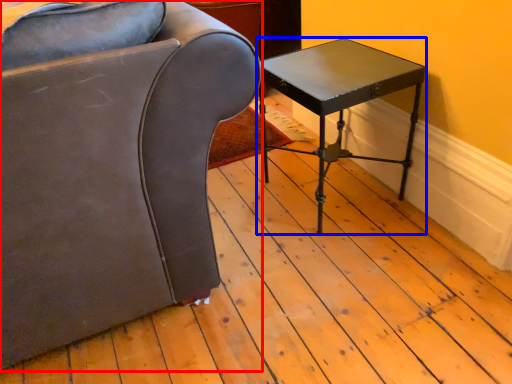
Question: Among these objects, which one is nearest to the camera, chair (highlighted by a red box) or table (highlighted by a blue box)?

Choices:
 (A) chair
 (B) table

Answer: (A)